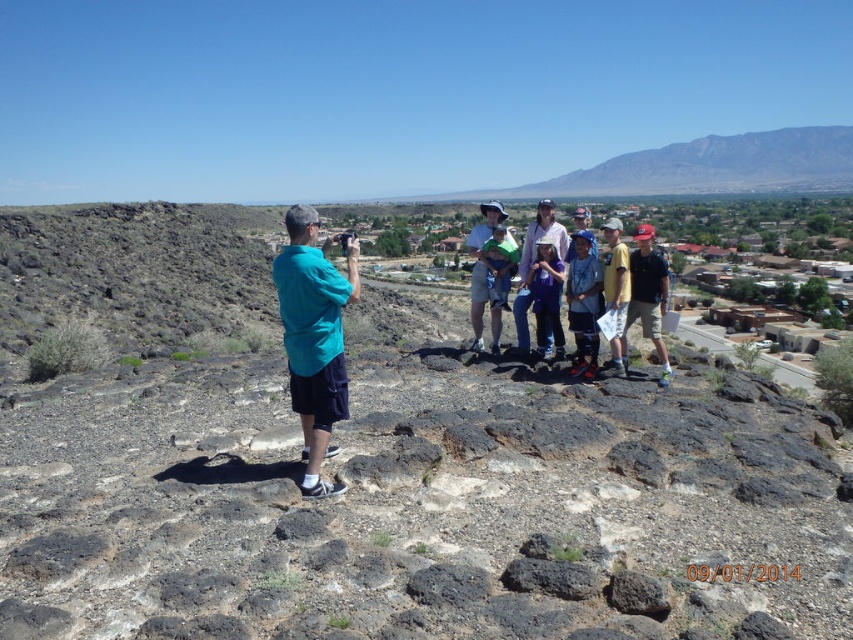
You are a photographer trying to capture a group photo. You see the teal fabric shirt at left and the green fabric shirt at center. Which shirt is positioned more to the left side of the group?

The teal fabric shirt at left is positioned more to the left side of the group than the green fabric shirt at center.

You are a photographer trying to frame two subjects in your shot. You have the teal fabric shirt at left and the green fabric shirt at center in your viewfinder. Which subject should you adjust to ensure both are fully visible in the frame?

Since the teal fabric shirt at left is shorter than the green fabric shirt at center, you should lower the camera angle slightly to include the full height of the taller green fabric shirt at center while keeping the teal fabric shirt at left in frame.

You are standing at the point marked by the coordinates point (648, 294) in the image. Looking around, which object from the scene is directly in front of you?

The point (648, 294) indicates the matte blue shirt at right, so the matte blue shirt at right is directly in front of you.